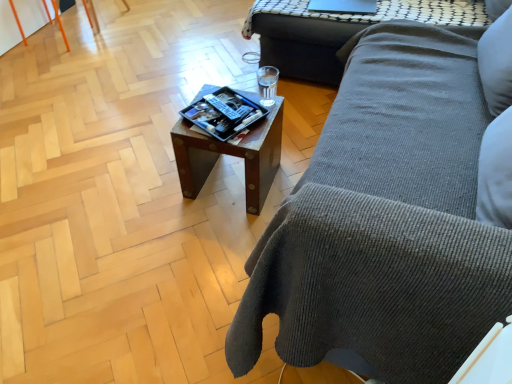
Question: Considering the relative positions of wooden tray at center, the 1th table when ordered from bottom to top, and matte black tray at center in the image provided, is wooden tray at center, the 1th table when ordered from bottom to top, to the right of matte black tray at center from the viewer's perspective?

Choices:
 (A) yes
 (B) no

Answer: (A)

Question: From the image's perspective, does wooden tray at center, the 1th table positioned from the front, appear lower than matte black tray at center?

Choices:
 (A) yes
 (B) no

Answer: (A)

Question: Considering the relative sizes of wooden tray at center, the 1th table when ordered from bottom to top, and matte black tray at center in the image provided, is wooden tray at center, the 1th table when ordered from bottom to top, bigger than matte black tray at center?

Choices:
 (A) yes
 (B) no

Answer: (A)

Question: Is wooden tray at center, the 1th table when ordered from left to right, turned away from matte black tray at center?

Choices:
 (A) no
 (B) yes

Answer: (A)

Question: Is wooden tray at center, the 1th table when ordered from bottom to top, to the left of matte black tray at center from the viewer's perspective?

Choices:
 (A) yes
 (B) no

Answer: (B)

Question: Does wooden tray at center, acting as the 2th table starting from the right, have a lesser height compared to matte black tray at center?

Choices:
 (A) no
 (B) yes

Answer: (A)

Question: Is matte black tray at center placed right next to sleek black laptop at upper center?

Choices:
 (A) yes
 (B) no

Answer: (B)

Question: From a real-world perspective, is matte black tray at center beneath sleek black laptop at upper center?

Choices:
 (A) yes
 (B) no

Answer: (A)

Question: Would you consider matte black tray at center to be distant from sleek black laptop at upper center?

Choices:
 (A) yes
 (B) no

Answer: (B)

Question: From a real-world perspective, is matte black tray at center over sleek black laptop at upper center?

Choices:
 (A) yes
 (B) no

Answer: (B)

Question: Is matte black tray at center at the right side of sleek black laptop at upper center?

Choices:
 (A) no
 (B) yes

Answer: (A)

Question: From the image's perspective, is matte black tray at center located above sleek black laptop at upper center?

Choices:
 (A) yes
 (B) no

Answer: (B)

Question: Can you confirm if wooden tray at center, the 1th table when ordered from bottom to top, is bigger than wooden side table at upper right, the 1th table positioned from the right?

Choices:
 (A) yes
 (B) no

Answer: (B)